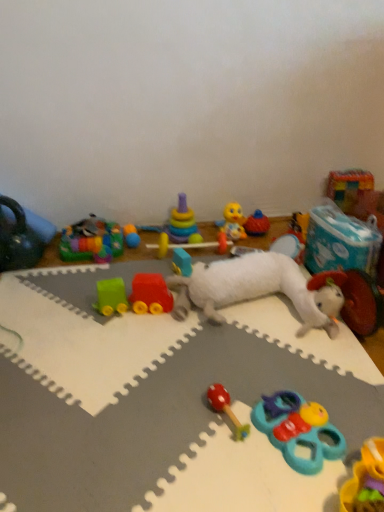
Locate an element on the screen. This screenshot has width=384, height=512. free space to the back side of rubber block at center, which is the fifth toy in left-to-right order is located at coordinates (187, 261).